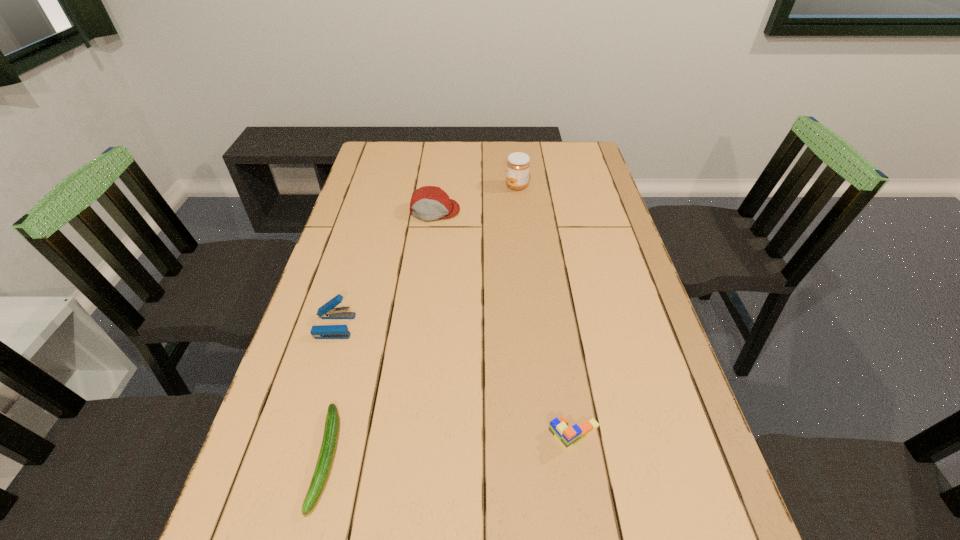
You are a GUI agent. You are given a task and a screenshot of the screen. Output one action in this format:
    pyautogui.click(x=<x>, y=<y>)
    Task: Click on the free space located 0.140m on the front-facing side of the third object from right to left
    The height and width of the screenshot is (540, 960).
    Given the screenshot: What is the action you would take?
    pyautogui.click(x=429, y=252)

The image size is (960, 540). I want to click on free spot located on the back of the third farthest object, so click(355, 258).

I want to click on vacant space located 0.170m on the back of the Lego, so click(562, 353).

The height and width of the screenshot is (540, 960). I want to click on stapler present at the left edge, so click(328, 311).

Locate an element on the screen. The height and width of the screenshot is (540, 960). zucchini present at the left edge is located at coordinates (331, 430).

Where is `vacant space at the far edge of the desktop`? Image resolution: width=960 pixels, height=540 pixels. vacant space at the far edge of the desktop is located at coordinates (496, 150).

Locate an element on the screen. This screenshot has height=540, width=960. vacant space at the left edge of the desktop is located at coordinates (308, 329).

This screenshot has height=540, width=960. What are the coordinates of `vacant space at the right edge of the desktop` in the screenshot? It's located at [x=610, y=346].

At what (x,y) coordinates should I click in order to perform the action: click on empty space between the shortest object and the tallest object. Please return your answer as a coordinate pair (x, y). The width and height of the screenshot is (960, 540). Looking at the image, I should click on (421, 322).

Find the location of a particular element. free spot between the fourth tallest object and the cap is located at coordinates (505, 323).